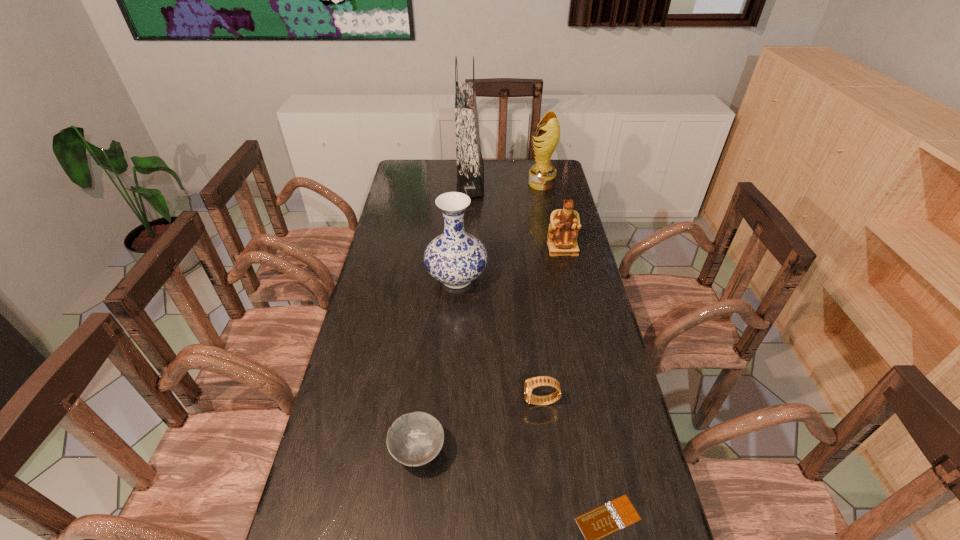
Where is `free location located 0.280m on the front-facing side of the award`? This screenshot has height=540, width=960. free location located 0.280m on the front-facing side of the award is located at coordinates (467, 184).

What are the coordinates of `free spot located 0.260m on the front-facing side of the award` in the screenshot? It's located at (470, 184).

This screenshot has width=960, height=540. What are the coordinates of `free space located on the front-facing side of the award` in the screenshot? It's located at point(442,184).

Where is `free region located 0.340m on the right of the vase`? The width and height of the screenshot is (960, 540). free region located 0.340m on the right of the vase is located at coordinates (586, 279).

Identify the location of vacant area located 0.390m on the front-facing side of the third farthest object. coord(583,339).

This screenshot has height=540, width=960. I want to click on vacant space situated 0.270m on the face of the fifth farthest object, so click(x=421, y=402).

Locate an element on the screen. Image resolution: width=960 pixels, height=540 pixels. vacant space located on the face of the fifth farthest object is located at coordinates (505, 402).

Where is `free space located on the face of the fifth farthest object`? free space located on the face of the fifth farthest object is located at coordinates (483, 402).

Find the location of `free space located 0.370m on the right of the bowl`. free space located 0.370m on the right of the bowl is located at coordinates (600, 451).

At what (x,y) coordinates should I click in order to perform the action: click on shopping bag present at the far edge. Please return your answer as a coordinate pair (x, y). Image resolution: width=960 pixels, height=540 pixels. Looking at the image, I should click on (470, 168).